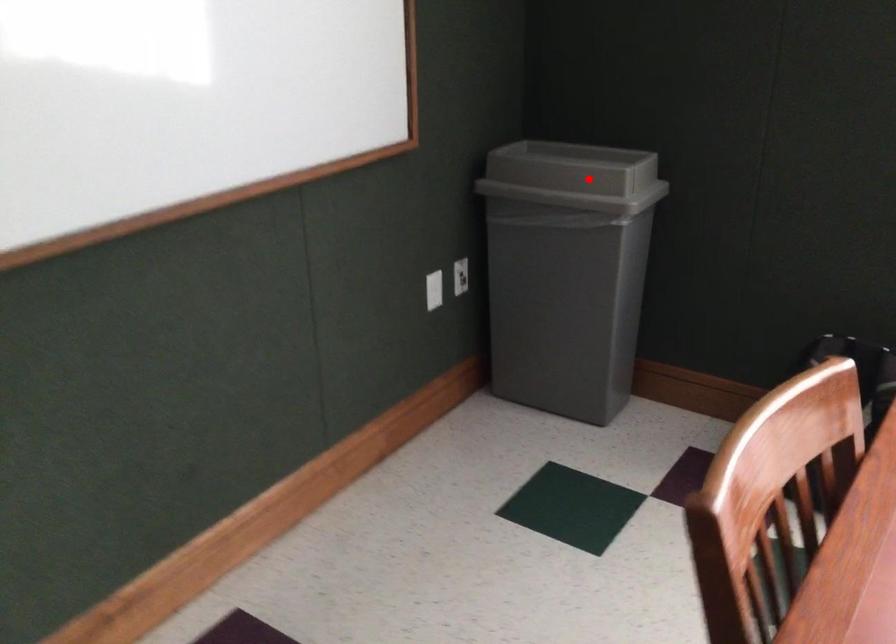
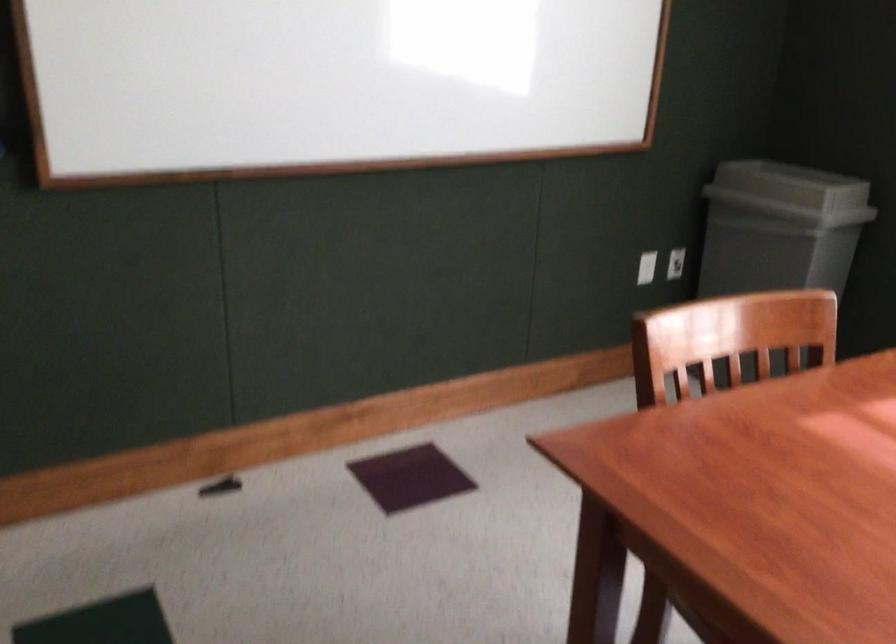
Question: I am providing you with two images of the same scene from different viewpoints. A red point is shown in image1. For the corresponding object point in image2, is it positioned nearer or farther from the camera?

Choices:
 (A) Nearer
 (B) Farther

Answer: (B)